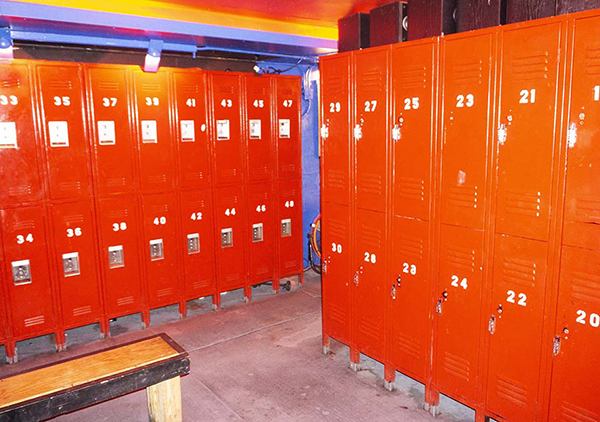
Locate an element on the screen. This screenshot has height=422, width=600. wood bench is located at coordinates (88, 359).